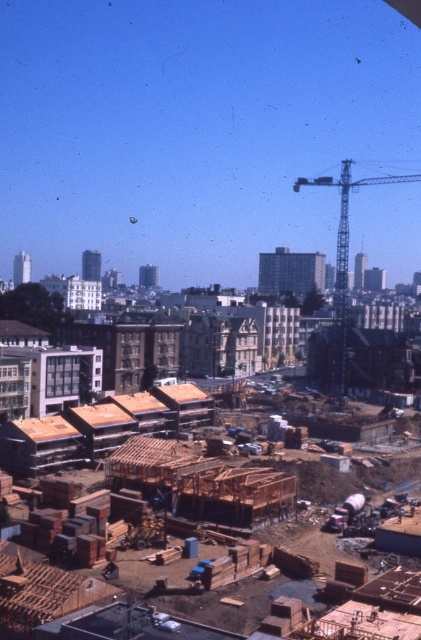
You are a construction worker standing at the point marked as point (151, 456). You need to move to the wooden frame at center. Is your current position already at the wooden frame at center?

Yes, because the point (151, 456) corresponds to the wooden frame at center, so you are already at the wooden frame at center.

You are a construction worker standing at the edge of the site. You need to move a heavy beam from the wooden frame at center to the metallic gray crane at upper right. Which object is closer to your current position?

The wooden frame at center is closer to the viewer than the metallic gray crane at upper right, so the wooden frame at center is closer to your current position.